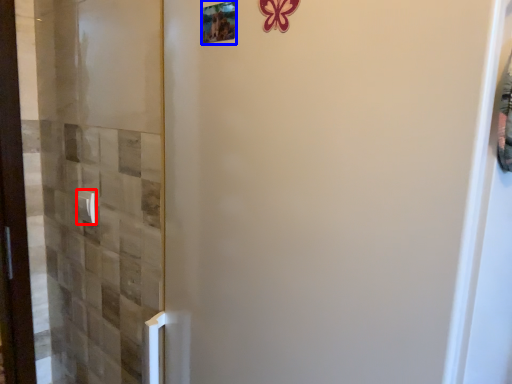
Question: Which object appears farthest to the camera in this image, door handle (highlighted by a red box) or picture frame (highlighted by a blue box)?

Choices:
 (A) door handle
 (B) picture frame

Answer: (A)